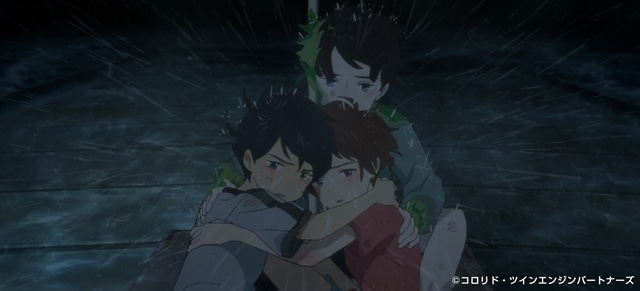
This screenshot has height=291, width=640. Find the location of `left side wooden frame`. left side wooden frame is located at coordinates (467, 261).